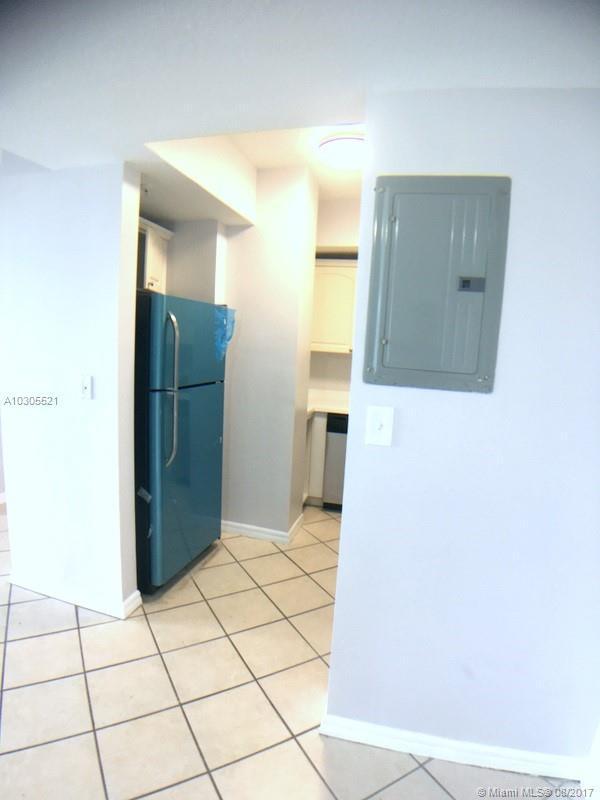
You are a GUI agent. You are given a task and a screenshot of the screen. Output one action in this format:
    pyautogui.click(x=<x>, y=<y>)
    Task: Click on the kitchen
    
    Given the screenshot: What is the action you would take?
    pyautogui.click(x=320, y=373)